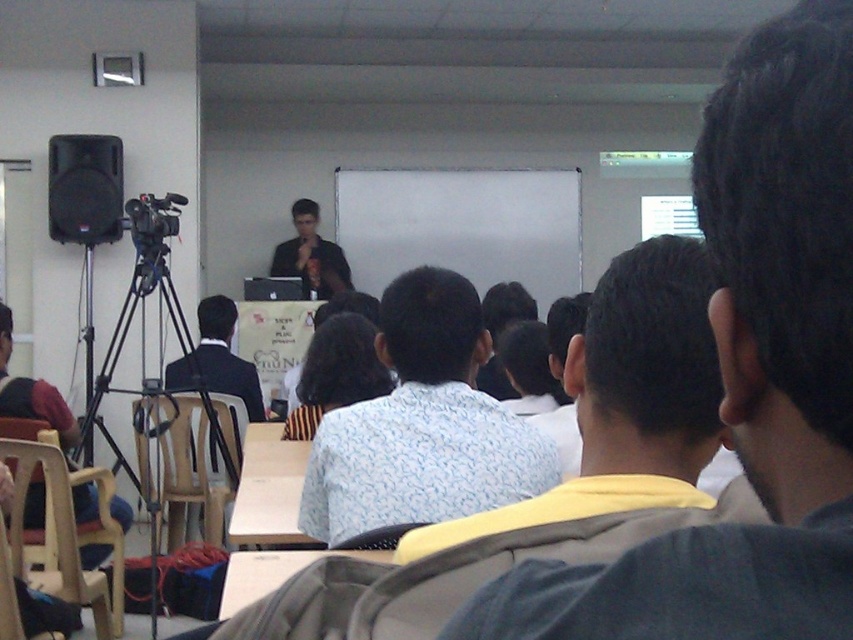
You are standing at the center of the room and want to move to the plastic chair at left. Given that the room is a coordinate system where the bottom left corner is the origin point, can you determine the direction you need to move in terms of the coordinate system?

The plastic chair at left is located at coordinate point (189,470). Since the origin is at the bottom left corner, moving towards the plastic chair at left would require moving to the right and slightly upwards from the center of the room.

You are organizing a small meeting in this classroom and need to arrange seating. If you want to place an additional chair next to the light brown plastic chair at lower left, will there be enough space considering the dark blue suit at center?

The light brown plastic chair at lower left occupies less space than the dark blue suit at center. Since the chair takes up less space, there should be enough room to place an additional chair next to it without interfering with the dark blue suit at center.

Based on the photo, you are an attendee in the classroom and want to see both the light blue patterned shirt at center and the black matte tripod at left. Which object appears larger in size?

The black matte tripod at left appears larger in size compared to the light blue patterned shirt at center.